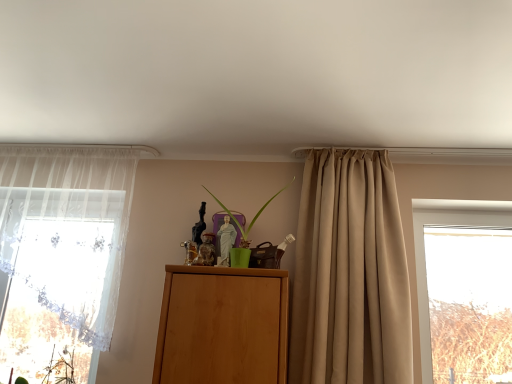
Question: Would you say beige satin curtain at center, the 1th curtain in the right-to-left sequence, contains sheer white curtain at left, positioned as the 1th curtain in left-to-right order?

Choices:
 (A) no
 (B) yes

Answer: (A)

Question: Would you consider beige satin curtain at center, which appears as the 2th curtain when viewed from the left, to be distant from sheer white curtain at left, the second curtain viewed from the right?

Choices:
 (A) yes
 (B) no

Answer: (A)

Question: Is beige satin curtain at center, which appears as the 2th curtain when viewed from the left, positioned behind sheer white curtain at left, the second curtain viewed from the right?

Choices:
 (A) no
 (B) yes

Answer: (A)

Question: From a real-world perspective, is beige satin curtain at center, the 1th curtain in the right-to-left sequence, on sheer white curtain at left, positioned as the 1th curtain in left-to-right order?

Choices:
 (A) no
 (B) yes

Answer: (A)

Question: Is sheer white curtain at left, the second curtain viewed from the right, at the back of beige satin curtain at center, which appears as the 2th curtain when viewed from the left?

Choices:
 (A) yes
 (B) no

Answer: (B)

Question: Considering the positions of point (250, 225) and point (349, 220), is point (250, 225) closer or farther from the camera than point (349, 220)?

Choices:
 (A) farther
 (B) closer

Answer: (A)

Question: From the image's perspective, relative to beige satin curtain at center, the 1th curtain in the right-to-left sequence, is green matte plant at center above or below?

Choices:
 (A) above
 (B) below

Answer: (A)

Question: In terms of size, does green matte plant at center appear bigger or smaller than beige satin curtain at center, the 1th curtain in the right-to-left sequence?

Choices:
 (A) small
 (B) big

Answer: (A)

Question: Visually, is green matte plant at center positioned to the left or to the right of beige satin curtain at center, the 1th curtain in the right-to-left sequence?

Choices:
 (A) left
 (B) right

Answer: (A)

Question: From the image's perspective, is sheer white curtain at left, the second curtain viewed from the right, located above or below green matte plant at center?

Choices:
 (A) below
 (B) above

Answer: (A)

Question: From their relative heights in the image, would you say sheer white curtain at left, positioned as the 1th curtain in left-to-right order, is taller or shorter than green matte plant at center?

Choices:
 (A) tall
 (B) short

Answer: (A)

Question: Is sheer white curtain at left, the second curtain viewed from the right, to the left or to the right of green matte plant at center in the image?

Choices:
 (A) right
 (B) left

Answer: (B)

Question: Considering the positions of point (19, 150) and point (244, 236), is point (19, 150) closer or farther from the camera than point (244, 236)?

Choices:
 (A) closer
 (B) farther

Answer: (B)

Question: Is beige satin curtain at center, the 1th curtain in the right-to-left sequence, taller or shorter than sheer white curtain at left, the second curtain viewed from the right?

Choices:
 (A) tall
 (B) short

Answer: (A)

Question: From the image's perspective, relative to sheer white curtain at left, the second curtain viewed from the right, is beige satin curtain at center, which appears as the 2th curtain when viewed from the left, above or below?

Choices:
 (A) above
 (B) below

Answer: (B)